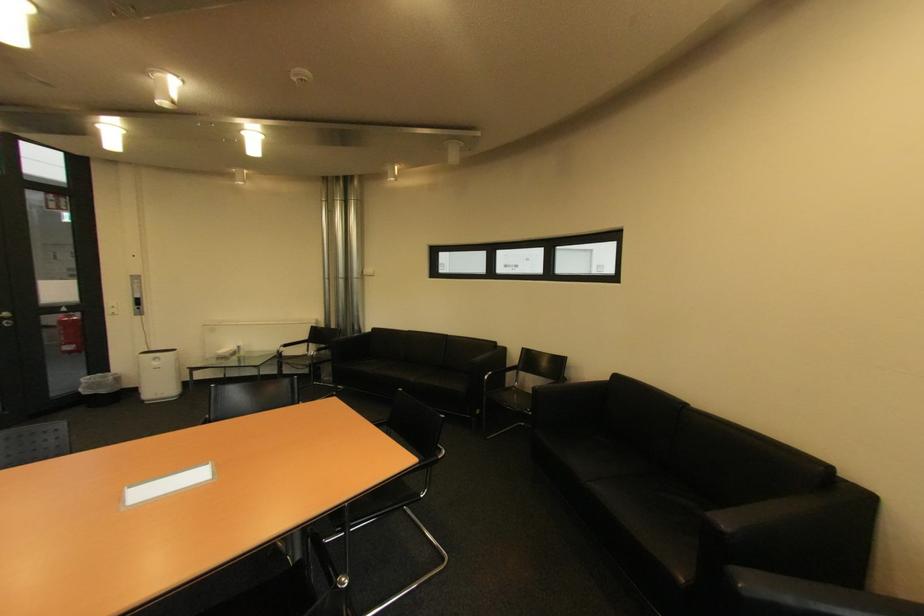
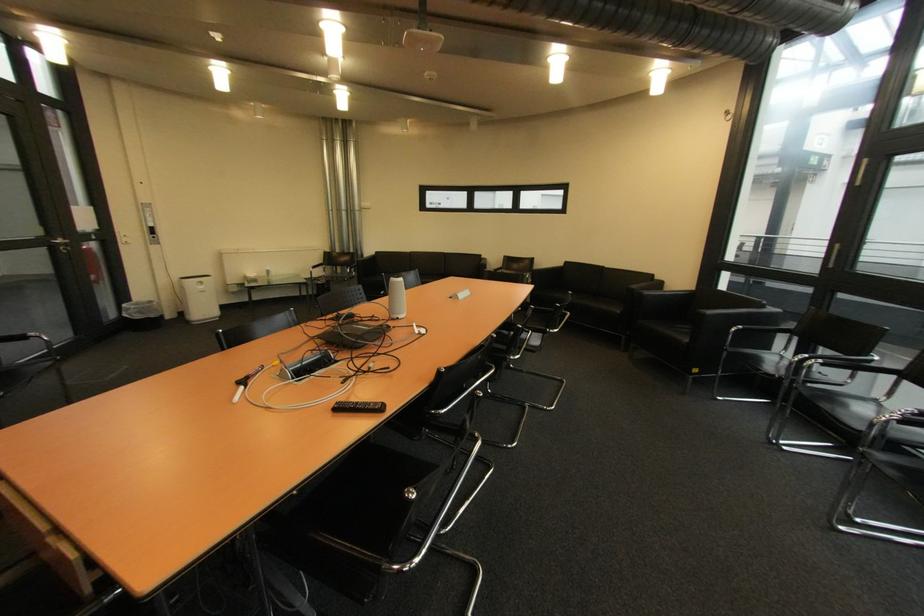
Locate, in the second image, the point that corresponds to [164,363] in the first image.

(209, 288)